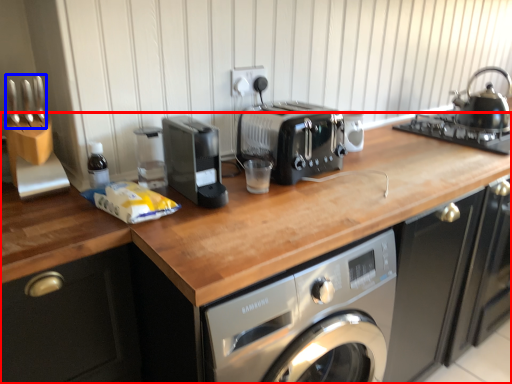
Question: Which object appears farthest to the camera in this image, countertop (highlighted by a red box) or cutlery (highlighted by a blue box)?

Choices:
 (A) countertop
 (B) cutlery

Answer: (B)